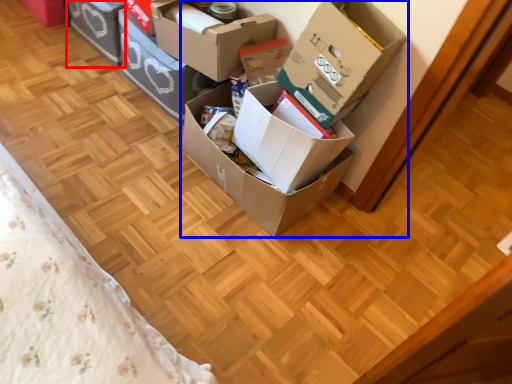
Question: Which object is further to the camera taking this photo, box (highlighted by a red box) or box (highlighted by a blue box)?

Choices:
 (A) box
 (B) box

Answer: (A)